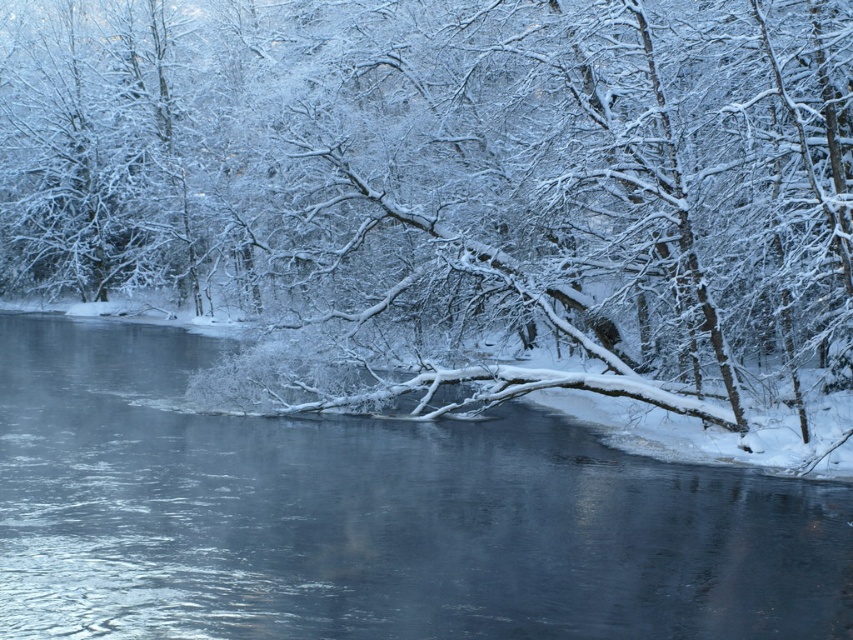
Question: Does snow-covered branch at center appear on the left side of smooth ice river at center?

Choices:
 (A) yes
 (B) no

Answer: (A)

Question: Which object appears closest to the camera in this image?

Choices:
 (A) snow-covered branch at center
 (B) smooth ice river at center

Answer: (B)

Question: Which point appears closest to the camera in this image?

Choices:
 (A) (410, 561)
 (B) (287, 276)

Answer: (A)

Question: Does snow-covered branch at center appear over smooth ice river at center?

Choices:
 (A) no
 (B) yes

Answer: (B)

Question: Is snow-covered branch at center to the left of smooth ice river at center from the viewer's perspective?

Choices:
 (A) no
 (B) yes

Answer: (B)